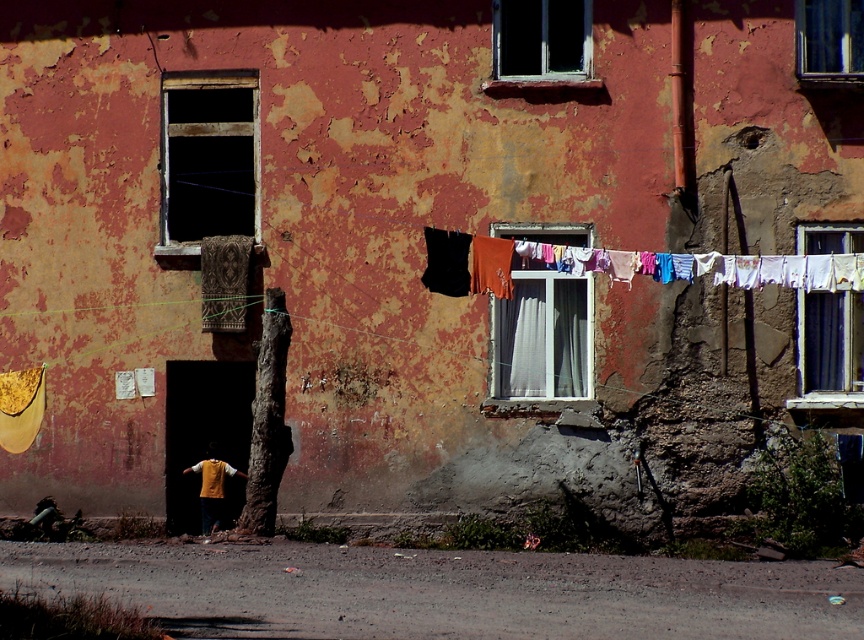
Find the location of a particular element. The image size is (864, 640). dark glass window at upper left is located at coordinates (207, 157).

Is point (217, 220) positioned after point (818, 74)?

Yes, it is.

You are a GUI agent. You are given a task and a screenshot of the screen. Output one action in this format:
    pyautogui.click(x=<x>, y=<y>)
    Task: Click on the dark glass window at upper left
    The height and width of the screenshot is (640, 864).
    Given the screenshot: What is the action you would take?
    pyautogui.click(x=207, y=157)

Is multicolored fabric clothesline at center smaller than white plastic window at center?

No.

Does point (753, 284) come farther from viewer compared to point (534, 394)?

No, (753, 284) is in front of (534, 394).

In order to click on multicolored fabric clothesline at center in this screenshot , I will do `click(630, 266)`.

Does transparent glass window at upper center have a larger size compared to white sheer curtain at upper right?

Yes, transparent glass window at upper center is bigger than white sheer curtain at upper right.

Can you confirm if transparent glass window at upper center is positioned below white sheer curtain at upper right?

Incorrect, transparent glass window at upper center is not positioned below white sheer curtain at upper right.

I want to click on transparent glass window at upper center, so click(x=542, y=44).